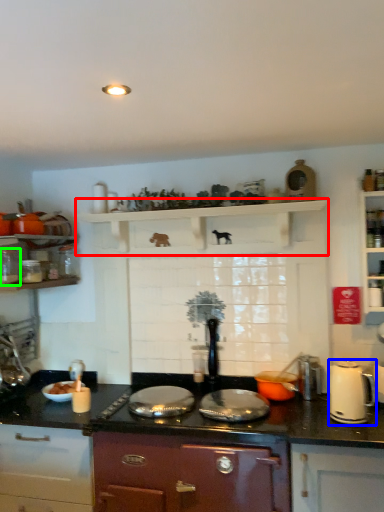
Question: Considering the real-world distances, which object is closest to shelf (highlighted by a red box)? kitchen appliance (highlighted by a blue box) or kitchen appliance (highlighted by a green box).

Choices:
 (A) kitchen appliance
 (B) kitchen appliance

Answer: (B)